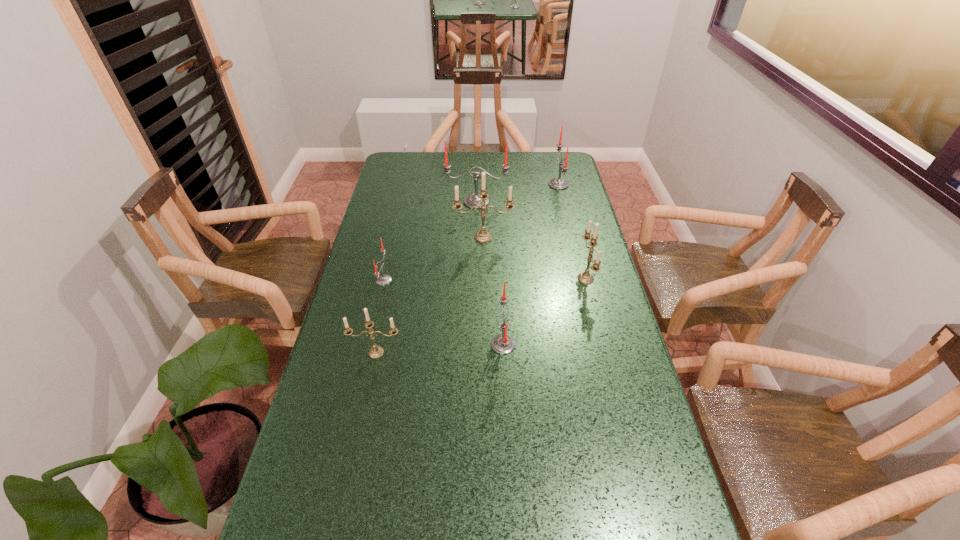
The image size is (960, 540). I want to click on the second closest red candle to the third farthest red candle, so click(x=471, y=200).

Identify the location of the closest metallic candle relative to the biggest red candle. point(483,236).

The height and width of the screenshot is (540, 960). I want to click on the closest metallic candle to the rightmost red candle, so 483,236.

Locate an element on the screen. Image resolution: width=960 pixels, height=540 pixels. free space that satisfies the following two spatial constraints: 1. on the front-facing side of the rightmost metallic candle; 2. on the right side of the rightmost red candle is located at coordinates (582, 279).

Locate an element on the screen. Image resolution: width=960 pixels, height=540 pixels. vacant point that satisfies the following two spatial constraints: 1. on the front-facing side of the rightmost red candle; 2. on the front-facing side of the biggest red candle is located at coordinates (563, 202).